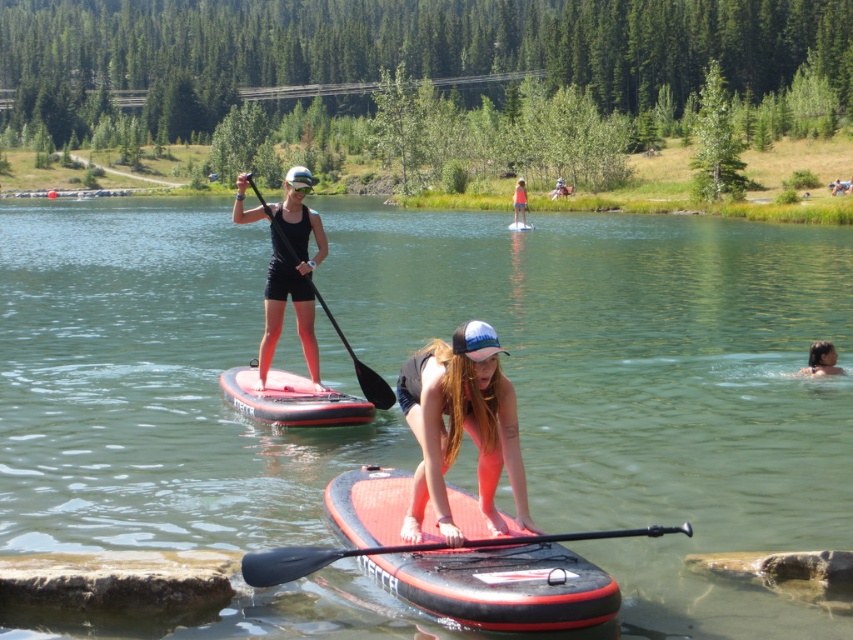
Question: Among these objects, which one is farthest from the camera?

Choices:
 (A) pink matte surfboard at center
 (B) rubberized red paddleboard at center
 (C) black matte paddle at upper center

Answer: (C)

Question: Which object appears closest to the camera in this image?

Choices:
 (A) black rubber paddle at center
 (B) rubberized red paddleboard at center
 (C) pink matte surfboard at center

Answer: (A)

Question: Which point is farther to the camera?

Choices:
 (A) translucent rubber paddleboard at center
 (B) matte black paddleboard at center

Answer: (B)

Question: Can you confirm if red rubber paddleboard at center is positioned to the right of black rubber paddle at center?

Choices:
 (A) yes
 (B) no

Answer: (B)

Question: Can you confirm if black rubber paddle at center is positioned to the right of smooth brown hair at lower right?

Choices:
 (A) no
 (B) yes

Answer: (A)

Question: Does smooth brown hair at lower right appear under white plastic canoe at center?

Choices:
 (A) yes
 (B) no

Answer: (A)